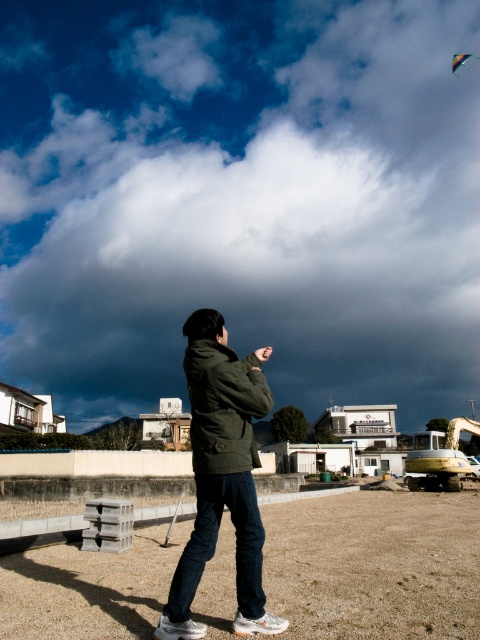
You are standing at the base of the stack of concrete blocks near the left side of the image. You want to fly a kite using the string you have. The kite needs to be positioned above the cloudy sky at upper center to catch the wind. Can you determine if the multicolored fabric kite at upper right is already positioned correctly for flying?

The cloudy sky at upper center is located below the multicolored fabric kite at upper right, so the kite is already positioned above the cloudy sky at upper center and is correctly placed for flying.